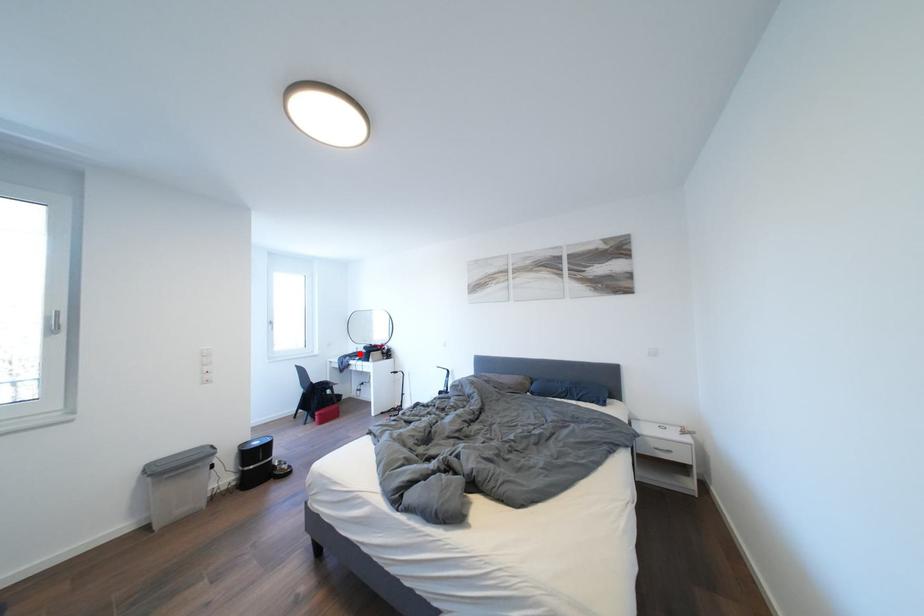
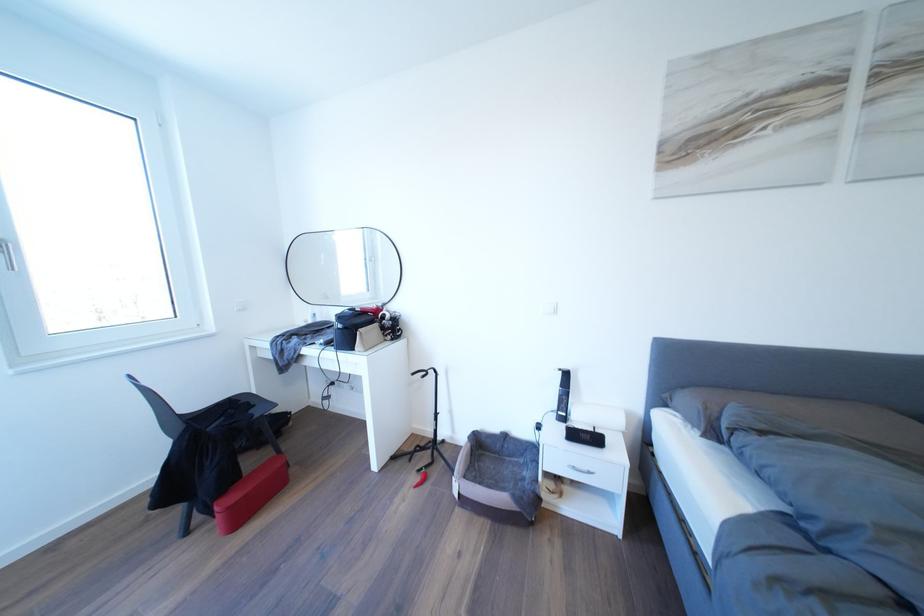
Where in the second image is the point corresponding to the highlighted location from the first image?

(310, 322)